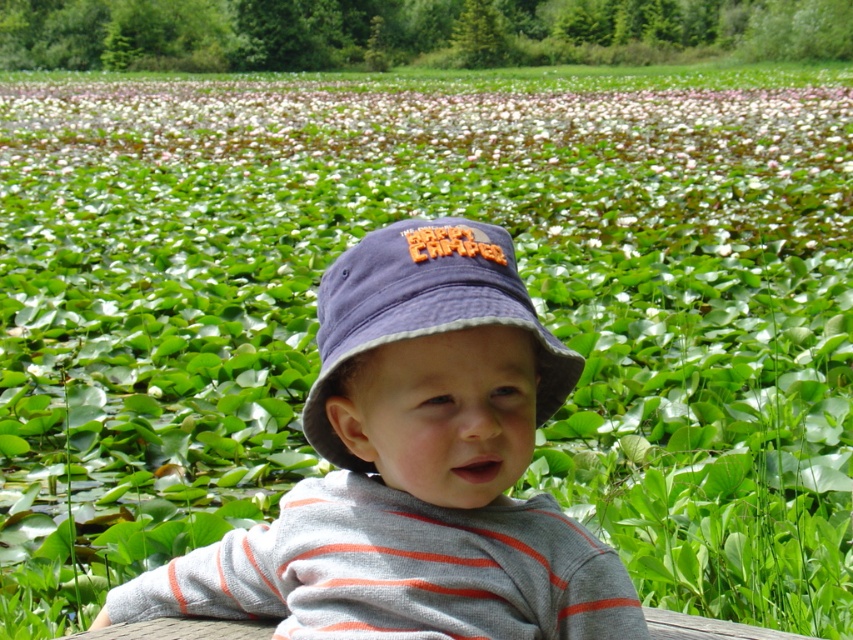
Does matte blue bucket hat at center have a greater height compared to green leafy plant at upper center?

No, matte blue bucket hat at center is not taller than green leafy plant at upper center.

Between point (515, 593) and point (447, 128), which one is positioned behind?

The point (447, 128) is behind.

At what (x,y) coordinates should I click in order to perform the action: click on matte blue bucket hat at center. Please return your answer as a coordinate pair (x, y). This screenshot has width=853, height=640. Looking at the image, I should click on (415, 468).

Between green leafy plant at upper center and navy blue fabric bucket hat at center, which one appears on the left side from the viewer's perspective?

Positioned to the left is navy blue fabric bucket hat at center.

Can you confirm if green leafy plant at upper center is positioned to the left of navy blue fabric bucket hat at center?

No, green leafy plant at upper center is not to the left of navy blue fabric bucket hat at center.

Is point (581, 173) in front of point (403, 328)?

No, (581, 173) is further to viewer.

Find the location of `green leafy plant at upper center`. green leafy plant at upper center is located at coordinates 480,145.

In the scene shown: Who is lower down, matte blue bucket hat at center or navy blue fabric bucket hat at center?

matte blue bucket hat at center is below.

Who is taller, matte blue bucket hat at center or navy blue fabric bucket hat at center?

Standing taller between the two is matte blue bucket hat at center.

Where is `matte blue bucket hat at center`? matte blue bucket hat at center is located at coordinates (415, 468).